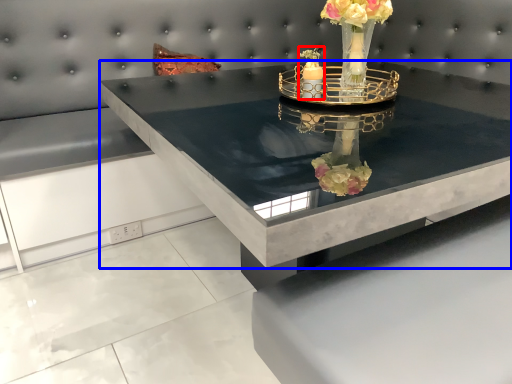
Question: Among these objects, which one is nearest to the camera, candle holder (highlighted by a red box) or table (highlighted by a blue box)?

Choices:
 (A) candle holder
 (B) table

Answer: (B)